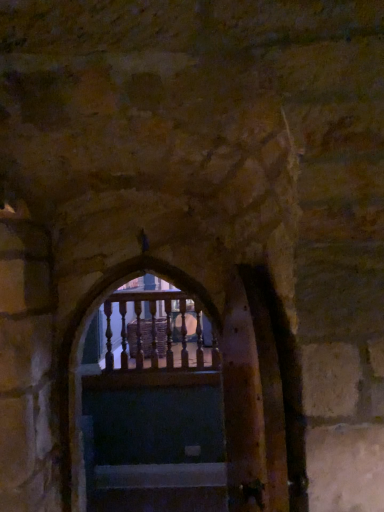
This screenshot has width=384, height=512. What do you see at coordinates (158, 332) in the screenshot?
I see `wooden balusters at center` at bounding box center [158, 332].

Measure the distance between wooden balusters at center and camera.

They are 3.95 meters apart.

Where is `wooden balusters at center`? The width and height of the screenshot is (384, 512). wooden balusters at center is located at coordinates (158, 332).

You are a GUI agent. You are given a task and a screenshot of the screen. Output one action in this format:
    pyautogui.click(x=<x>, y=<y>)
    Task: Click on the wooden stairs at center
    
    Given the screenshot: What is the action you would take?
    pyautogui.click(x=160, y=488)

In order to face wooden stairs at center, should I rotate leftwards or rightwards?

Turn left by 5.549 degrees to look at wooden stairs at center.

What is the approximate height of wooden stairs at center?

wooden stairs at center is 1.80 inches tall.

The width and height of the screenshot is (384, 512). Describe the element at coordinates (160, 488) in the screenshot. I see `wooden stairs at center` at that location.

What are the coordinates of `wooden balusters at center` in the screenshot? It's located at (158, 332).

Can you confirm if wooden balusters at center is positioned to the left of wooden stairs at center?

Correct, you'll find wooden balusters at center to the left of wooden stairs at center.

Considering their positions, is wooden balusters at center located in front of or behind wooden stairs at center?

wooden balusters at center is positioned farther from the viewer than wooden stairs at center.

Is point (123, 333) positioned before point (207, 490)?

No, it is behind (207, 490).

From the image's perspective, which one is positioned lower, wooden balusters at center or wooden stairs at center?

From the image's view, wooden stairs at center is below.

From a real-world perspective, is wooden balusters at center physically above wooden stairs at center?

Yes, from a real-world perspective, wooden balusters at center is above wooden stairs at center.

In terms of width, does wooden balusters at center look wider or thinner when compared to wooden stairs at center?

wooden balusters at center is thinner than wooden stairs at center.

Between wooden balusters at center and wooden stairs at center, which one has less height?

wooden stairs at center is shorter.

Is wooden balusters at center bigger or smaller than wooden stairs at center?

Clearly, wooden balusters at center is larger in size than wooden stairs at center.

Would you say wooden balusters at center contains wooden stairs at center?

No, wooden stairs at center is not inside wooden balusters at center.

From the picture: Is wooden balusters at center positioned far away from wooden stairs at center?

Yes, wooden balusters at center and wooden stairs at center are quite far apart.

Is wooden stairs at center at the back of wooden balusters at center?

wooden balusters at center is not turned away from wooden stairs at center.

How different are the orientations of wooden balusters at center and wooden stairs at center in degrees?

The angular difference between wooden balusters at center and wooden stairs at center is 1.02 degrees.

Measure the distance between wooden balusters at center and wooden stairs at center.

wooden balusters at center and wooden stairs at center are 3.81 feet apart.

Where is `stairs below the wooden balusters at center (from a real-world perspective)`? The height and width of the screenshot is (512, 384). stairs below the wooden balusters at center (from a real-world perspective) is located at coordinates (160, 488).

Between wooden stairs at center and wooden balusters at center, which one appears on the right side from the viewer's perspective?

wooden stairs at center.

Is wooden stairs at center closer to camera compared to wooden balusters at center?

Yes.

Between point (162, 483) and point (108, 359), which one is positioned behind?

The point (108, 359) is farther from the camera.

From the image's perspective, relative to wooden balusters at center, is wooden stairs at center above or below?

wooden stairs at center is below wooden balusters at center.

Looking at this image, from a real-world perspective, does wooden stairs at center stand above wooden balusters at center?

Incorrect, from a real-world perspective, wooden stairs at center is lower than wooden balusters at center.

Considering the sizes of wooden stairs at center and wooden balusters at center in the image, is wooden stairs at center wider or thinner than wooden balusters at center?

wooden stairs at center is wider than wooden balusters at center.

Considering the sizes of wooden stairs at center and wooden balusters at center in the image, is wooden stairs at center taller or shorter than wooden balusters at center?

In the image, wooden stairs at center appears to be shorter than wooden balusters at center.

Looking at the image, does wooden stairs at center seem bigger or smaller compared to wooden balusters at center?

Clearly, wooden stairs at center is smaller in size than wooden balusters at center.

Is wooden balusters at center completely or partially inside wooden stairs at center?

Actually, wooden balusters at center is outside wooden stairs at center.

Is there a large distance between wooden stairs at center and wooden balusters at center?

Yes.

Is wooden stairs at center aimed at wooden balusters at center?

No.

How different are the orientations of wooden stairs at center and wooden balusters at center in degrees?

wooden stairs at center and wooden balusters at center are facing 1.02 degrees away from each other.

This screenshot has width=384, height=512. I want to click on stairs on the right of wooden balusters at center, so click(x=160, y=488).

The width and height of the screenshot is (384, 512). I want to click on stairs that appears below the wooden balusters at center (from a real-world perspective), so click(x=160, y=488).

In the image, there is a wooden stairs at center. Where is `balcony above it (from the image's perspective)`? Image resolution: width=384 pixels, height=512 pixels. balcony above it (from the image's perspective) is located at coordinates (158, 332).